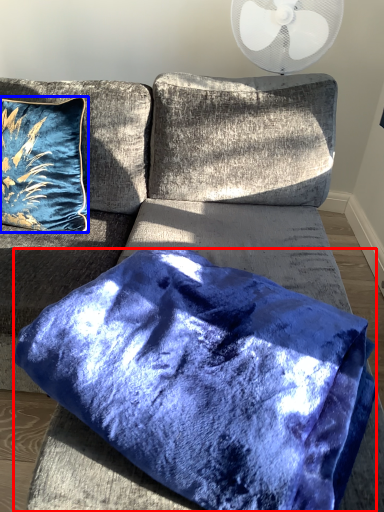
Question: Which object is closer to the camera taking this photo, pillow (highlighted by a red box) or pillow (highlighted by a blue box)?

Choices:
 (A) pillow
 (B) pillow

Answer: (A)